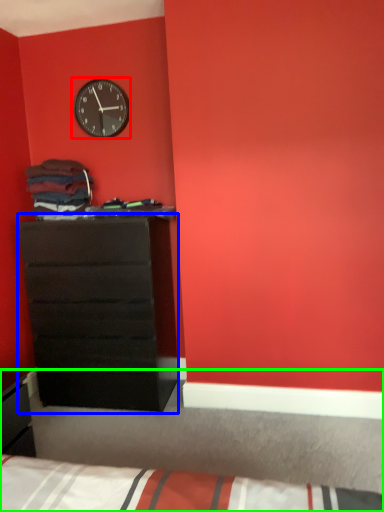
Question: Considering the real-world distances, which object is farthest from wall clock (highlighted by a red box)? chest of drawers (highlighted by a blue box) or bed (highlighted by a green box)?

Choices:
 (A) chest of drawers
 (B) bed

Answer: (B)